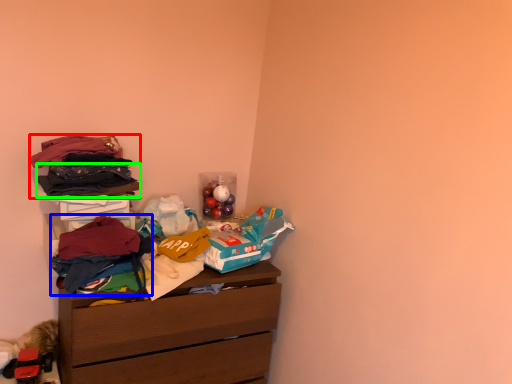
Question: Considering the real-world distances, which object is farthest from clothing (highlighted by a red box)? clothing (highlighted by a blue box) or clothing (highlighted by a green box)?

Choices:
 (A) clothing
 (B) clothing

Answer: (A)